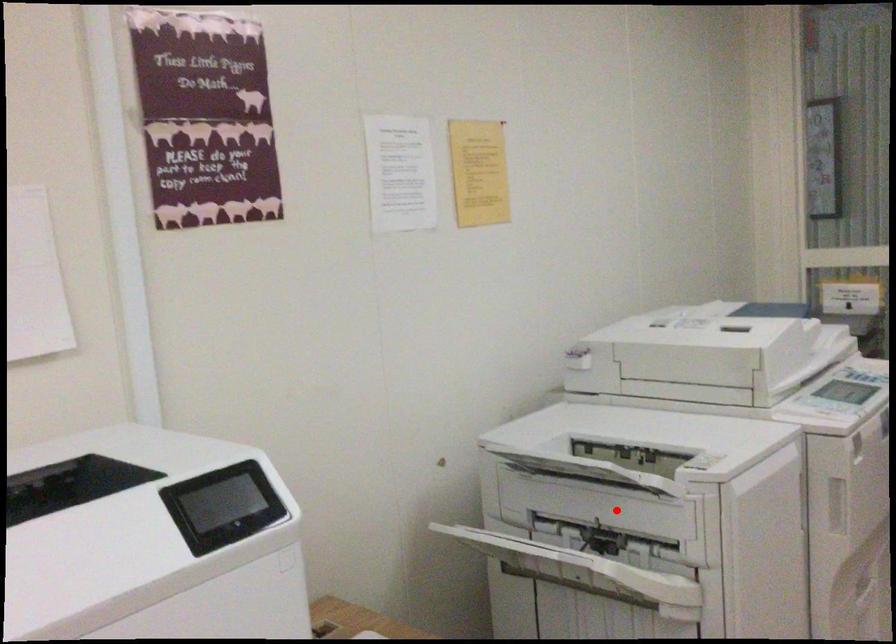
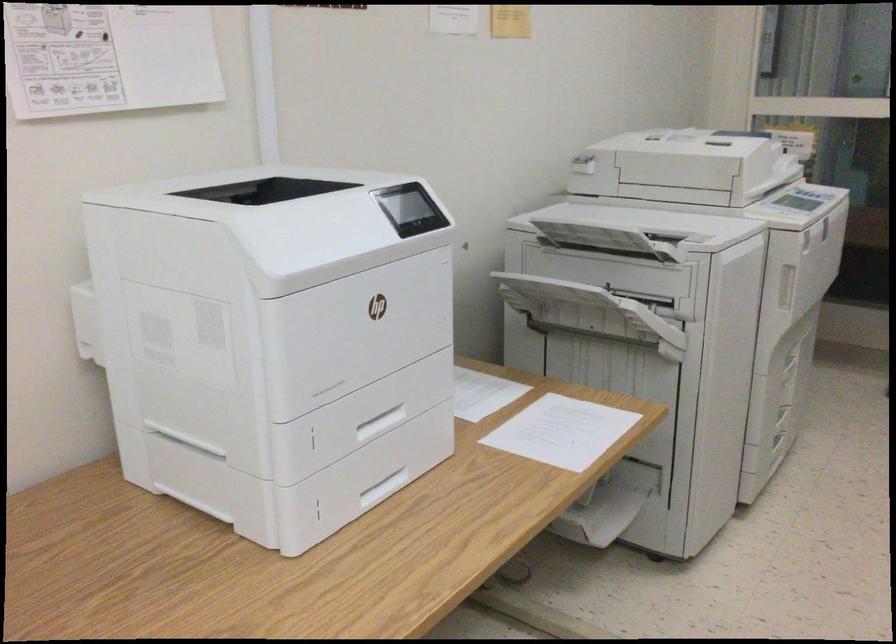
Locate, in the second image, the point that corresponds to the highlighted location in the first image.

(623, 270)